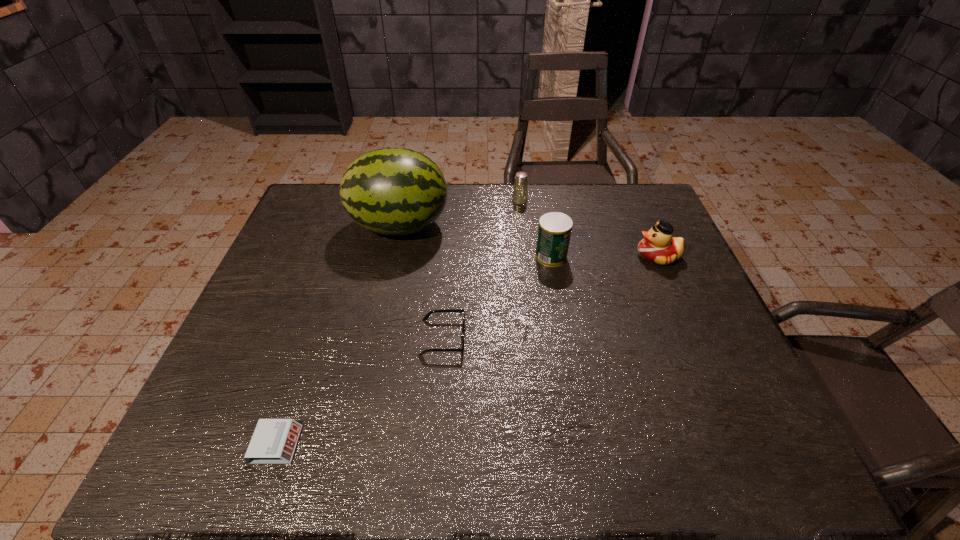
Locate an element on the screen. This screenshot has width=960, height=540. vacant point located between the third object from right to left and the nearest object is located at coordinates (398, 322).

This screenshot has width=960, height=540. I want to click on vacant area that lies between the shortest object and the rightmost object, so click(468, 350).

Locate an element on the screen. The image size is (960, 540). free area in between the can and the saltshaker is located at coordinates (536, 228).

You are a GUI agent. You are given a task and a screenshot of the screen. Output one action in this format:
    pyautogui.click(x=<x>, y=<y>)
    Task: Click on the empty location between the can and the duck
    This screenshot has width=960, height=540.
    Given the screenshot: What is the action you would take?
    pyautogui.click(x=605, y=256)

What are the coordinates of `vacant area that lies between the watermelon and the fifth tallest object` in the screenshot? It's located at (421, 282).

This screenshot has width=960, height=540. I want to click on empty location between the sunglasses and the fourth object from left to right, so click(481, 269).

Find the location of a particular element. This screenshot has width=960, height=540. free spot between the nearest object and the fifth farthest object is located at coordinates (360, 391).

Locate which object is the fourth closest to the sunglasses. Please provide its 2D coordinates. Your answer should be formatted as a tuple, i.e. [(x, y)], where the tuple contains the x and y coordinates of a point satisfying the conditions above.

[(520, 192)]

Locate an element on the screen. This screenshot has height=540, width=960. object that ranks as the third closest to the tallest object is located at coordinates (554, 231).

I want to click on free region that satisfies the following two spatial constraints: 1. on the front side of the saltshaker; 2. on the left side of the fifth object from left to right, so click(x=526, y=256).